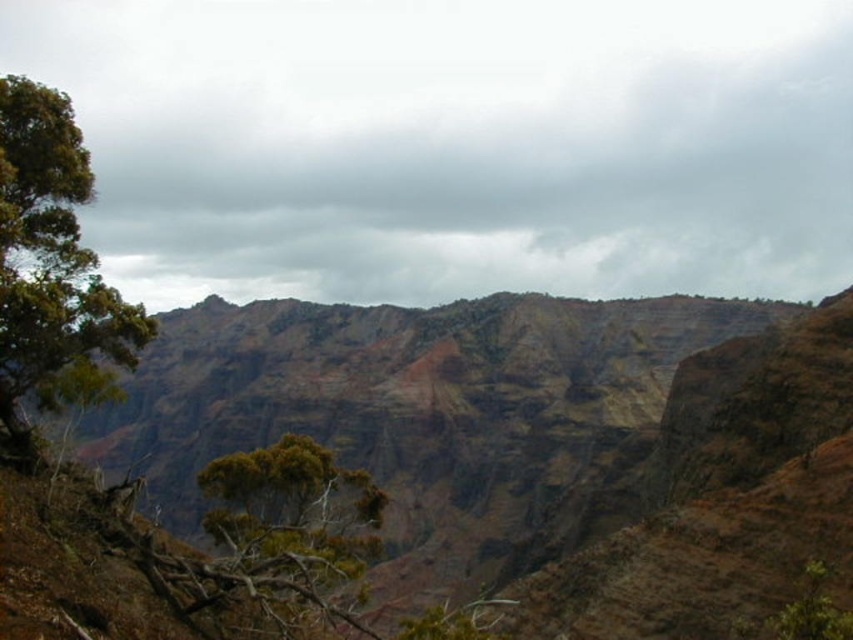
Is brown rocky mountain at center positioned in front of green leafy tree at left?

That is True.

This screenshot has width=853, height=640. What do you see at coordinates (514, 436) in the screenshot?
I see `brown rocky mountain at center` at bounding box center [514, 436].

In order to click on brown rocky mountain at center in this screenshot , I will do `click(514, 436)`.

Between green leafy tree at left and green leafy tree at center, which one is positioned higher?

Positioned higher is green leafy tree at left.

From the picture: Does green leafy tree at left appear on the right side of green leafy tree at center?

Yes, green leafy tree at left is to the right of green leafy tree at center.

Image resolution: width=853 pixels, height=640 pixels. What are the coordinates of `green leafy tree at left` in the screenshot? It's located at (x=49, y=256).

Image resolution: width=853 pixels, height=640 pixels. In order to click on green leafy tree at left in this screenshot , I will do `click(49, 256)`.

Does brown rocky mountain at center lie in front of green leafy tree at center?

That is True.

Who is lower down, brown rocky mountain at center or green leafy tree at center?

green leafy tree at center is lower down.

Does point (283, 312) come behind point (236, 516)?

That is True.

Where is `brown rocky mountain at center`? The image size is (853, 640). brown rocky mountain at center is located at coordinates (514, 436).